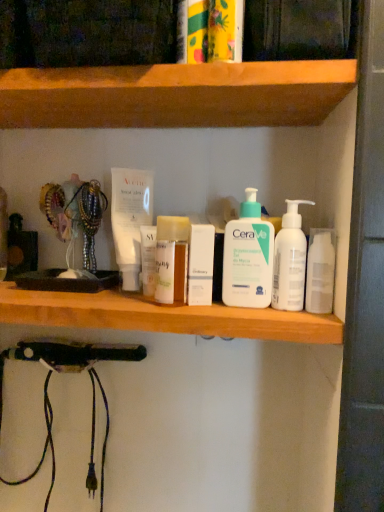
You are a GUI agent. You are given a task and a screenshot of the screen. Output one action in this format:
    pyautogui.click(x=<x>, y=<y>)
    Task: Click on the free location above white plastic bottles at center, marked as the 1th shelf in a bottom-to-top arrangement (from a real-world perspective)
    The image size is (384, 512).
    Given the screenshot: What is the action you would take?
    pyautogui.click(x=120, y=295)